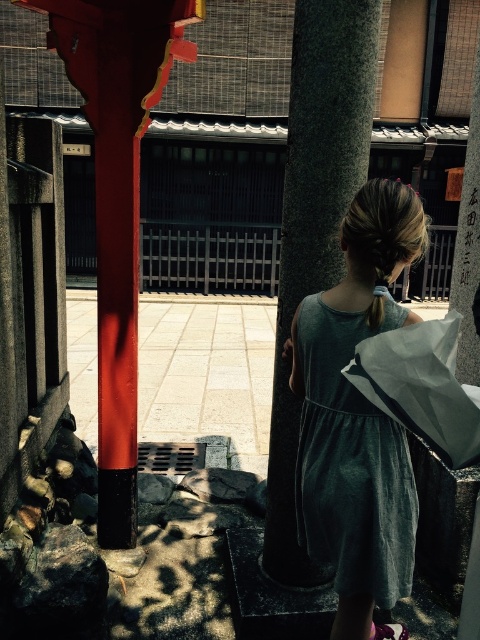
Can you confirm if smooth red pole at left is positioned above white paper bag at center?

Indeed, smooth red pole at left is positioned over white paper bag at center.

Is point (101, 20) more distant than point (383, 346)?

Yes, it is behind point (383, 346).

Locate an element on the screen. This screenshot has width=480, height=640. smooth red pole at left is located at coordinates (118, 202).

Does smooth red pole at left have a larger size compared to velvet teal dress at center?

Yes.

Does smooth red pole at left have a lesser height compared to velvet teal dress at center?

Incorrect, smooth red pole at left's height does not fall short of velvet teal dress at center's.

Where is `smooth red pole at left`? The image size is (480, 640). smooth red pole at left is located at coordinates (118, 202).

Where is `smooth red pole at left`? This screenshot has height=640, width=480. smooth red pole at left is located at coordinates (118, 202).

Looking at this image, does smooth gray stone pillar at center have a larger size compared to velvet teal dress at center?

Indeed, smooth gray stone pillar at center has a larger size compared to velvet teal dress at center.

Consider the image. Does smooth gray stone pillar at center lie in front of velvet teal dress at center?

That is False.

In order to click on smooth gray stone pillar at center in this screenshot , I will do `click(314, 224)`.

Find the location of a particular element. The height and width of the screenshot is (640, 480). smooth gray stone pillar at center is located at coordinates (314, 224).